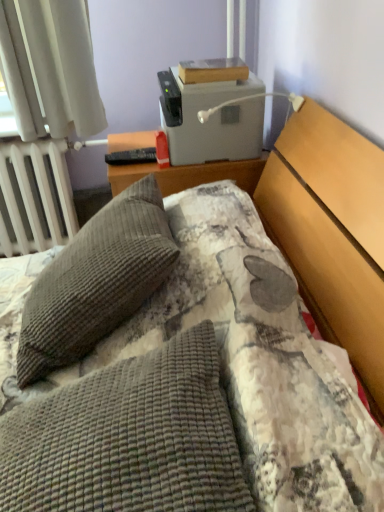
Question: Is point (23, 346) positioned closer to the camera than point (33, 499)?

Choices:
 (A) closer
 (B) farther

Answer: (B)

Question: From a real-world perspective, is gray corduroy pillow at left, acting as the second pillow starting from the front, above or below brown corduroy pillow at center, the 2th pillow viewed from the back?

Choices:
 (A) above
 (B) below

Answer: (A)

Question: Based on their relative distances, which object is farther from the gray plastic printer at upper center?

Choices:
 (A) wooden book at upper center
 (B) gray corduroy pillow at left, which appears as the first pillow when viewed from the back
 (C) white plastic lamp at upper right
 (D) brown corduroy pillow at center, the 2th pillow viewed from the back
 (E) white metallic radiator at left

Answer: (D)

Question: Estimate the real-world distances between objects in this image. Which object is farther from the white plastic lamp at upper right?

Choices:
 (A) wooden book at upper center
 (B) gray plastic printer at upper center
 (C) brown corduroy pillow at center, which is the first pillow in front-to-back order
 (D) gray corduroy pillow at left, acting as the second pillow starting from the front
 (E) white metallic radiator at left

Answer: (C)